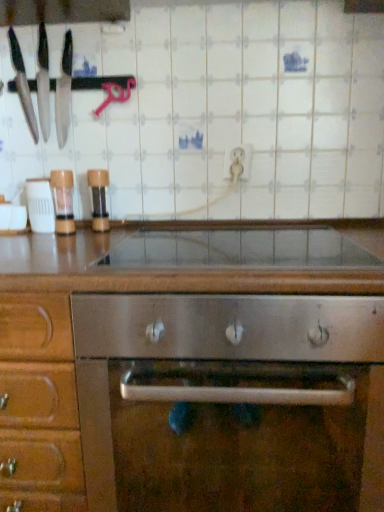
Question: Are brown wood pepper grinder at left, acting as the 3th appliance starting from the left, and matte black knives at left, the 2th kitchen appliance viewed from the right, located far from each other?

Choices:
 (A) yes
 (B) no

Answer: (B)

Question: Is brown wood pepper grinder at left, which ranks as the first appliance in right-to-left order, at the left side of matte black knives at left, the 1th kitchen appliance viewed from the left?

Choices:
 (A) yes
 (B) no

Answer: (B)

Question: Is brown wood pepper grinder at left, which ranks as the first appliance in right-to-left order, taller than matte black knives at left, the 1th kitchen appliance viewed from the left?

Choices:
 (A) yes
 (B) no

Answer: (B)

Question: Is brown wood pepper grinder at left, which ranks as the first appliance in right-to-left order, aimed at matte black knives at left, the 2th kitchen appliance viewed from the right?

Choices:
 (A) no
 (B) yes

Answer: (A)

Question: Is brown wood pepper grinder at left, acting as the 3th appliance starting from the left, placed right next to matte black knives at left, the 1th kitchen appliance viewed from the left?

Choices:
 (A) no
 (B) yes

Answer: (A)

Question: From the image's perspective, relative to stainless steel knives at left, which is counted as the first kitchen appliance, starting from the right, is matte black knives at left, the 1th kitchen appliance viewed from the left, above or below?

Choices:
 (A) above
 (B) below

Answer: (A)

Question: From a real-world perspective, is matte black knives at left, the 2th kitchen appliance viewed from the right, positioned above or below stainless steel knives at left, which is counted as the first kitchen appliance, starting from the right?

Choices:
 (A) above
 (B) below

Answer: (A)

Question: Which is correct: matte black knives at left, the 1th kitchen appliance viewed from the left, is inside stainless steel knives at left, which ranks as the 2th kitchen appliance in left-to-right order, or outside of it?

Choices:
 (A) inside
 (B) outside

Answer: (B)

Question: Looking at the image, does matte black knives at left, the 1th kitchen appliance viewed from the left, seem bigger or smaller compared to stainless steel knives at left, which is counted as the first kitchen appliance, starting from the right?

Choices:
 (A) big
 (B) small

Answer: (A)

Question: Is stainless steel oven at center in front of or behind clear plastic shaker at left, placed as the second appliance when sorted from left to right, in the image?

Choices:
 (A) behind
 (B) front

Answer: (B)

Question: Considering the positions of stainless steel oven at center and clear plastic shaker at left, which ranks as the 2th appliance in right-to-left order, in the image, is stainless steel oven at center bigger or smaller than clear plastic shaker at left, which ranks as the 2th appliance in right-to-left order,?

Choices:
 (A) small
 (B) big

Answer: (B)

Question: In terms of height, does stainless steel oven at center look taller or shorter compared to clear plastic shaker at left, which ranks as the 2th appliance in right-to-left order?

Choices:
 (A) tall
 (B) short

Answer: (A)

Question: Is point 190,264 closer or farther from the camera than point 49,185?

Choices:
 (A) farther
 (B) closer

Answer: (B)

Question: From their relative heights in the image, would you say stainless steel knives at left, which is counted as the first kitchen appliance, starting from the right, is taller or shorter than stainless steel oven at center?

Choices:
 (A) tall
 (B) short

Answer: (B)

Question: Considering the positions of stainless steel knives at left, which is counted as the first kitchen appliance, starting from the right, and stainless steel oven at center in the image, is stainless steel knives at left, which is counted as the first kitchen appliance, starting from the right, wider or thinner than stainless steel oven at center?

Choices:
 (A) thin
 (B) wide

Answer: (A)